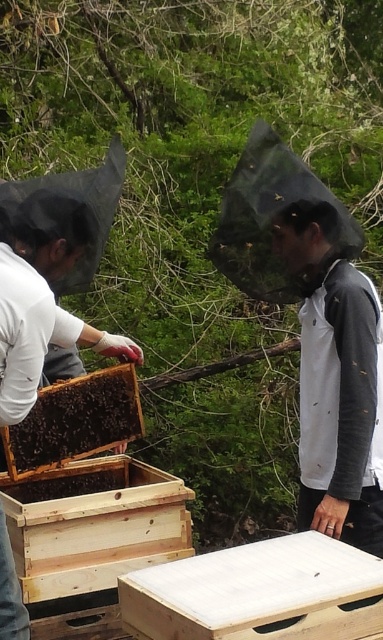
You are a beekeeper trying to locate your jacket. You see the white matte jacket at center and the dark brown wooden beehive at center. Which object is located to the right of the other?

The white matte jacket at center is positioned on the right side of dark brown wooden beehive at center.

From the picture: You are a drone operator tasked with capturing aerial footage of the beekeeping scene. Your drone is currently positioned 10 feet above the ground and needs to maintain a safe distance of at least 5 feet from any person to avoid disturbing them. Can your drone safely capture footage of the white matte jacket at center without violating the safety distance requirement?

The white matte jacket at center is 7.51 feet away from the camera. Since the drone needs to stay at least 5 feet away, and the current distance is 7.51 feet, the drone can safely capture footage as it meets the safety requirement.

Based on the photo, you are a beekeeper standing at the edge of the forest. You see a point marked at coordinates (335, 381) in the image. What object does this point correspond to?

The point at coordinates (335, 381) corresponds to the white matte jacket at center.